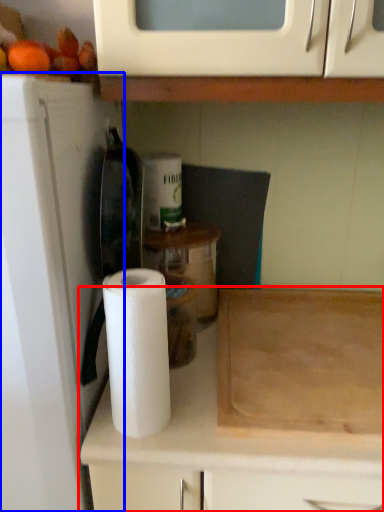
Question: Among these objects, which one is nearest to the camera, cabinetry (highlighted by a red box) or appliance (highlighted by a blue box)?

Choices:
 (A) cabinetry
 (B) appliance

Answer: (B)